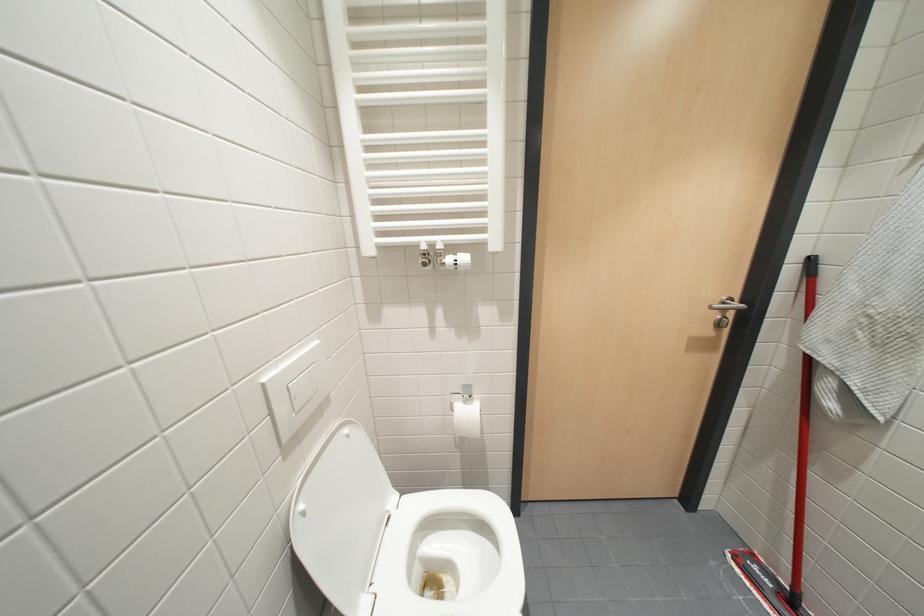
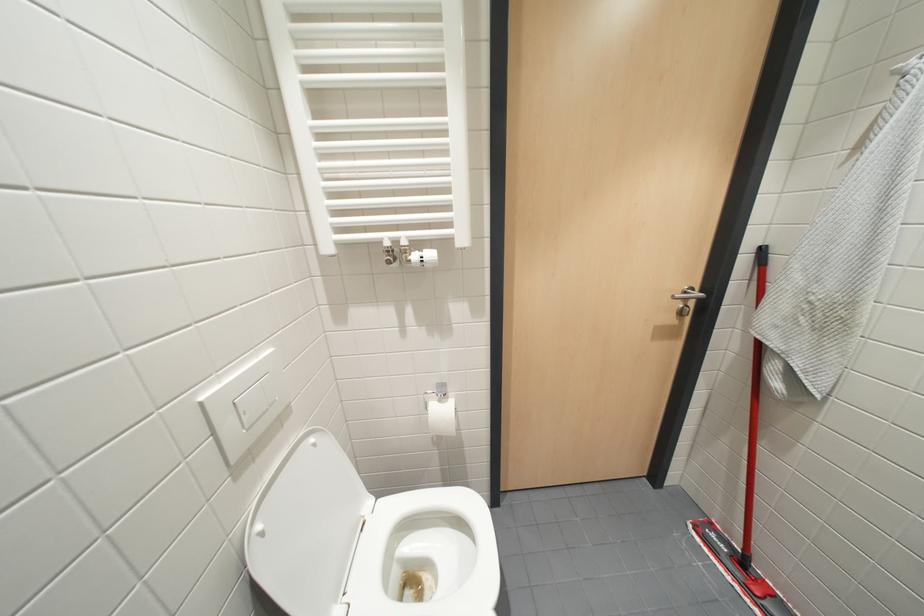
What movement of the cameraman would produce the second image?

The movement direction of the cameraman is right, forward.